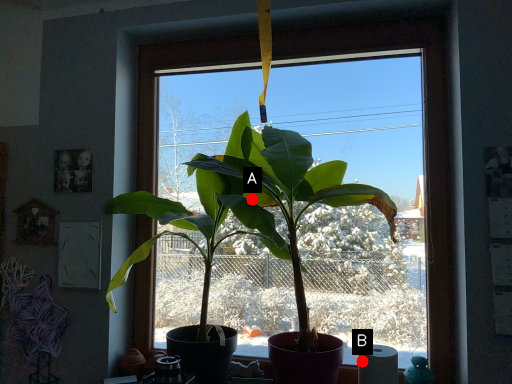
Question: Two points are circled on the image, labeled by A and B beside each circle. Which point appears farthest from the camera in this image?

Choices:
 (A) A is further
 (B) B is further

Answer: (A)